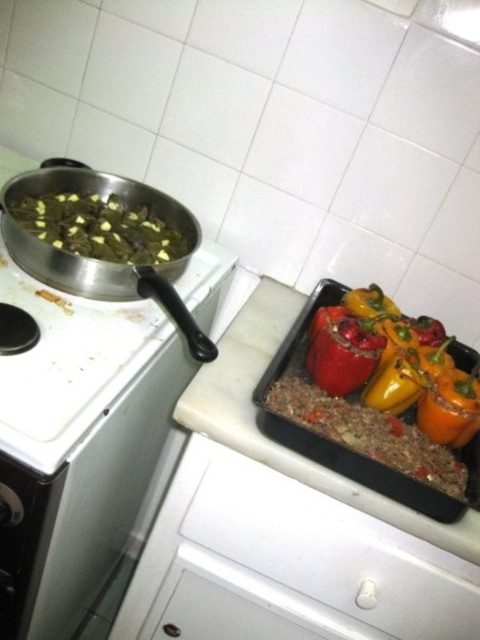
You are organizing the kitchen and need to store the green matte vegetables at left. There is a white plastic drawer at lower center available. Can you place the vegetables into the drawer without moving any other items?

The white plastic drawer at lower center is below the green matte vegetables at left, so yes, you can place the vegetables into the drawer without moving other items as the drawer is positioned lower and directly beneath them.